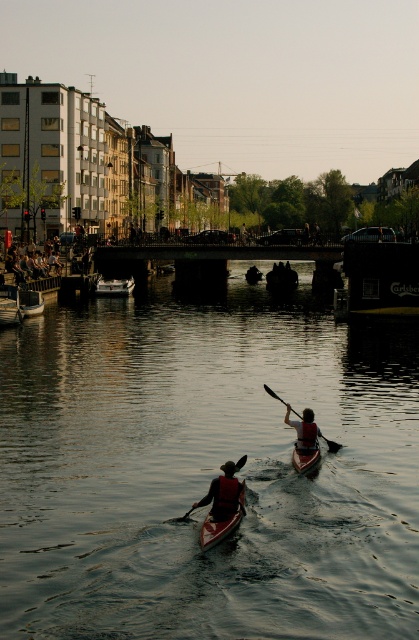
Does dark red life vest at center have a greater width compared to black plastic paddle at center?

No.

Who is lower down, dark red life vest at center or black plastic paddle at center?

dark red life vest at center is lower down.

Consider the image. Who is more distant from viewer, (222, 488) or (320, 433)?

Point (320, 433)

You are a GUI agent. You are given a task and a screenshot of the screen. Output one action in this format:
    pyautogui.click(x=<x>, y=<y>)
    Task: Click on the dark red life vest at center
    The image size is (419, 640).
    Given the screenshot: What is the action you would take?
    pyautogui.click(x=224, y=492)

Can you confirm if matte red canoe at center is positioned to the left of black plastic paddle at center?

Yes, matte red canoe at center is to the left of black plastic paddle at center.

Is matte red canoe at center wider than black plastic paddle at center?

No, matte red canoe at center is not wider than black plastic paddle at center.

Is point (318, 458) positioned after point (343, 445)?

No, (318, 458) is closer to viewer.

Where is `matte red canoe at center`? matte red canoe at center is located at coordinates (305, 458).

Who is more distant from viewer, (x=289, y=593) or (x=277, y=397)?

Point (x=277, y=397)

You are a GUI agent. You are given a task and a screenshot of the screen. Output one action in this format:
    pyautogui.click(x=<x>, y=<y>)
    Task: Click on the silvery water at center
    The height and width of the screenshot is (640, 419).
    Given the screenshot: What is the action you would take?
    pyautogui.click(x=206, y=470)